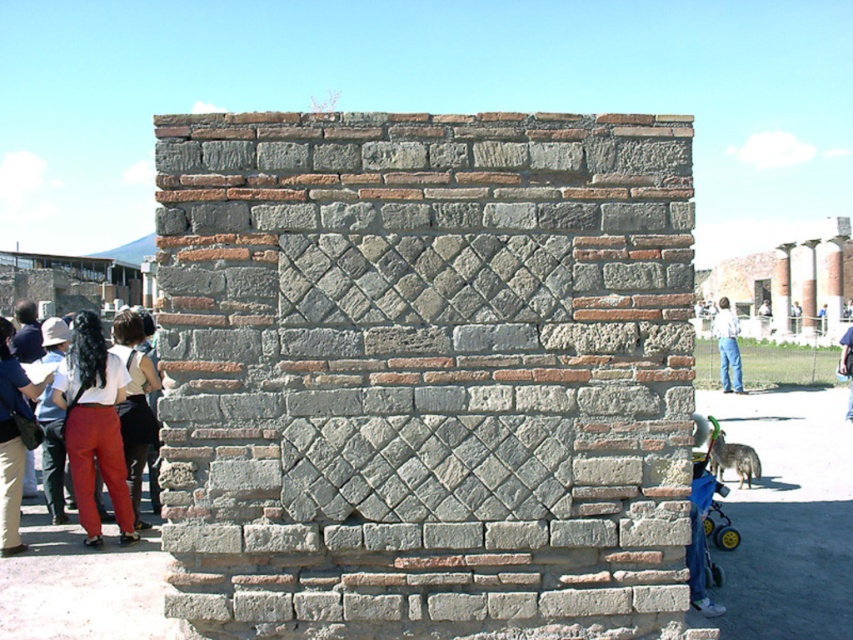
Question: Which point is farther to the camera?

Choices:
 (A) blue fabric stroller at lower right
 (B) matte white pants at lower left

Answer: (B)

Question: Is matte black shirt at left wider than blue fabric stroller at lower right?

Choices:
 (A) no
 (B) yes

Answer: (A)

Question: In this image, where is matte black shirt at left located relative to blue fabric stroller at lower right?

Choices:
 (A) right
 (B) left

Answer: (B)

Question: Which of the following is the closest to the observer?

Choices:
 (A) matte white pants at lower left
 (B) matte black hair at left
 (C) blue fabric stroller at lower right
 (D) matte black shirt at left

Answer: (C)

Question: Considering the real-world distances, which object is closest to the gray stone wall at center?

Choices:
 (A) matte black shirt at left
 (B) blue fabric stroller at lower right
 (C) denim pants at lower right

Answer: (B)

Question: Is matte white pants at lower left below matte black hair at left?

Choices:
 (A) yes
 (B) no

Answer: (A)